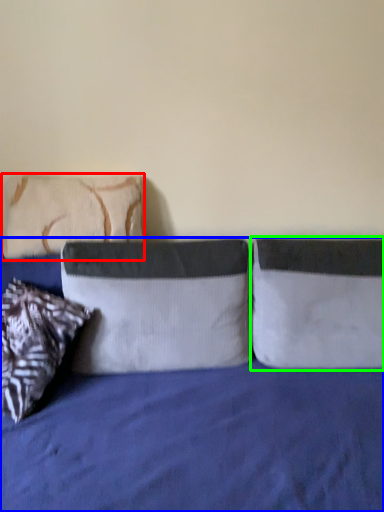
Question: Based on their relative distances, which object is farther from pillow (highlighted by a red box)? Choose from bed (highlighted by a blue box) and pillow (highlighted by a green box).

Choices:
 (A) bed
 (B) pillow

Answer: (B)